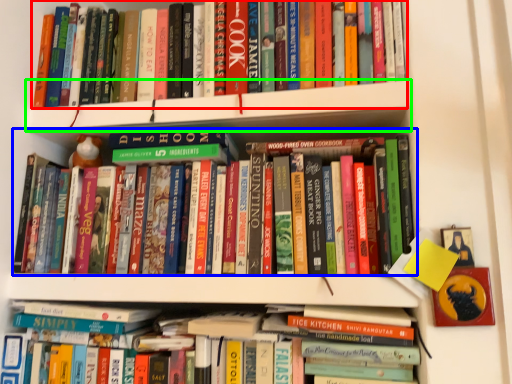
Question: Estimate the real-world distances between objects in this image. Which object is farther from book (highlighted by a red box), book (highlighted by a blue box) or shelf (highlighted by a green box)?

Choices:
 (A) book
 (B) shelf

Answer: (A)